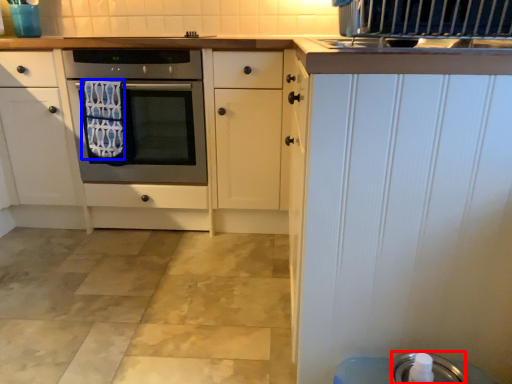
Question: Which point is closer to the camera, appliance (highlighted by a red box) or bath towel (highlighted by a blue box)?

Choices:
 (A) appliance
 (B) bath towel

Answer: (A)